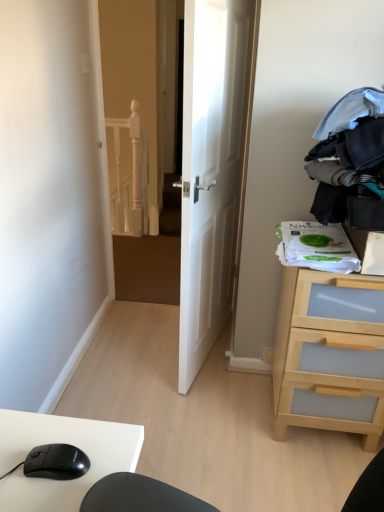
Question: Can you confirm if light wood/transparent drawer at right is smaller than black matte mouse at lower left?

Choices:
 (A) no
 (B) yes

Answer: (A)

Question: Could you tell me if light wood/transparent drawer at right is facing black matte mouse at lower left?

Choices:
 (A) no
 (B) yes

Answer: (A)

Question: Does light wood/transparent drawer at right appear on the right side of black matte mouse at lower left?

Choices:
 (A) yes
 (B) no

Answer: (A)

Question: Can you confirm if light wood/transparent drawer at right is taller than black matte mouse at lower left?

Choices:
 (A) no
 (B) yes

Answer: (B)

Question: Does light wood/transparent drawer at right contain black matte mouse at lower left?

Choices:
 (A) yes
 (B) no

Answer: (B)

Question: Does light wood/transparent drawer at right lie in front of black matte mouse at lower left?

Choices:
 (A) yes
 (B) no

Answer: (B)

Question: Considering the relative sizes of black matte mouse at lower left and dark blue fabric at upper right in the image provided, is black matte mouse at lower left bigger than dark blue fabric at upper right?

Choices:
 (A) yes
 (B) no

Answer: (B)

Question: Is black matte mouse at lower left to the right of dark blue fabric at upper right from the viewer's perspective?

Choices:
 (A) yes
 (B) no

Answer: (B)

Question: Is black matte mouse at lower left thinner than dark blue fabric at upper right?

Choices:
 (A) no
 (B) yes

Answer: (B)

Question: From the image's perspective, is black matte mouse at lower left above dark blue fabric at upper right?

Choices:
 (A) yes
 (B) no

Answer: (B)

Question: Is black matte mouse at lower left next to dark blue fabric at upper right and touching it?

Choices:
 (A) no
 (B) yes

Answer: (A)

Question: Does black matte mouse at lower left have a lesser height compared to dark blue fabric at upper right?

Choices:
 (A) yes
 (B) no

Answer: (A)

Question: Does white glossy door at center have a lesser height compared to light wood/transparent drawer at right?

Choices:
 (A) yes
 (B) no

Answer: (B)